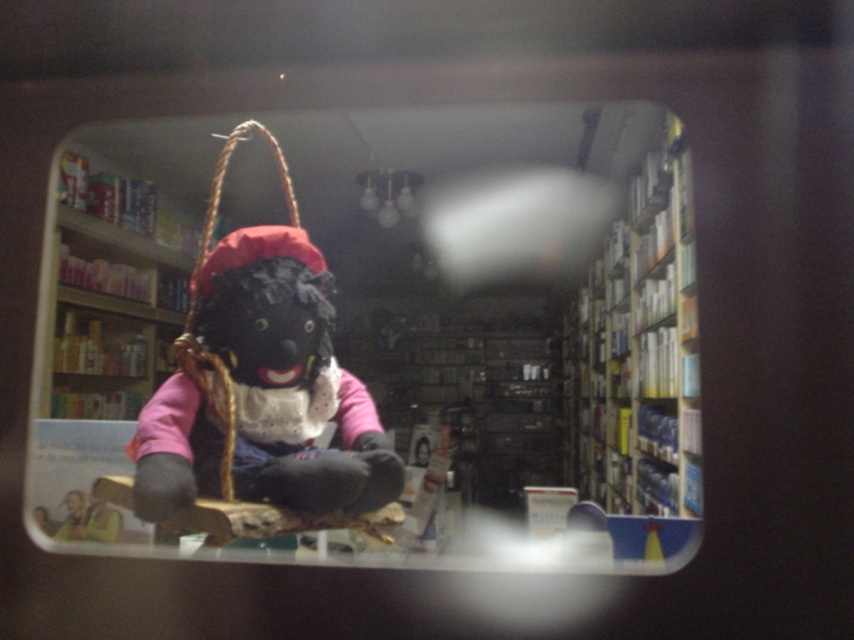
You are a customer in a pharmacy store. You see a velvet plush doll at center and a white cardboard bookshelf at right. Which object is closer to the floor?

The velvet plush doll at center is closer to the floor because it is positioned below the white cardboard bookshelf at right.

You are a customer in a store and see the velvet plush doll at center through a window. You want to know if the point at coordinates (366, 336) is on the doll. Can you confirm?

Yes, the point at coordinates (366, 336) is on the velvet plush doll at center.

You are a customer in a store and want to pick up the velvet plush doll at center and the matte black doll at center. Which one can you reach first without moving your current position?

The velvet plush doll at center is closer to you than the matte black doll at center, so you can reach it first without moving.